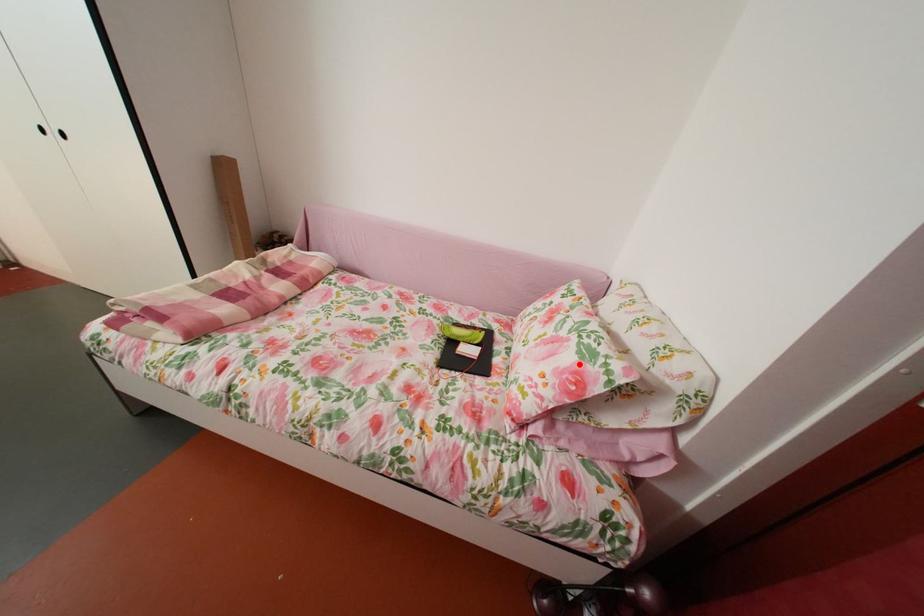
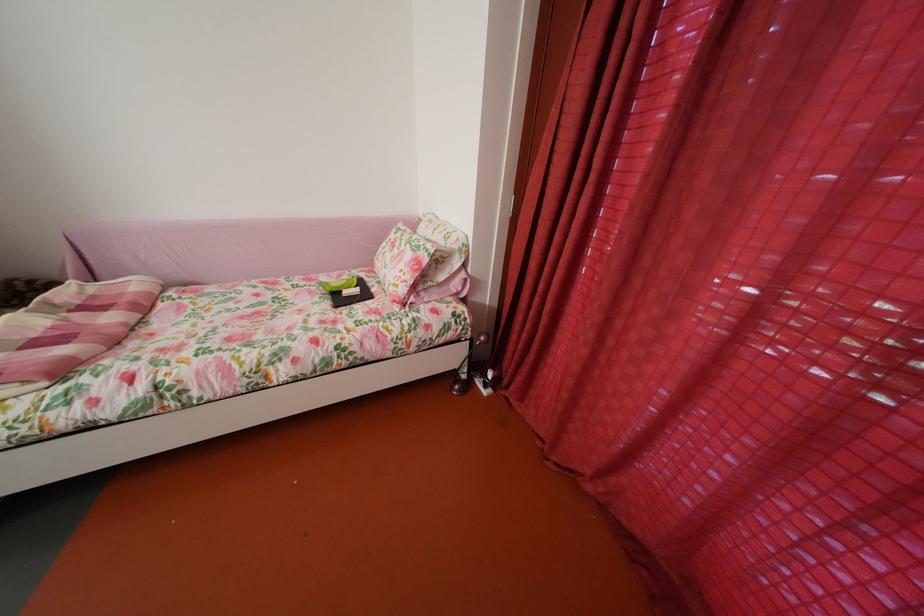
Locate, in the second image, the point that corresponds to the highlighted location in the first image.

(419, 262)